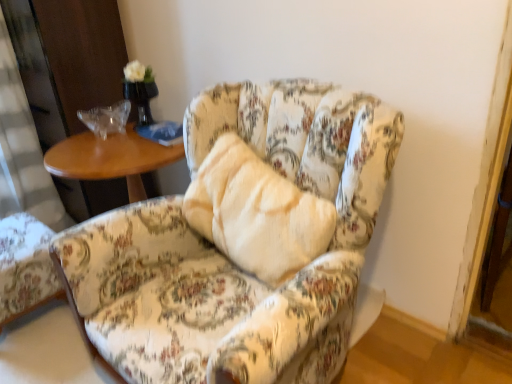
Question: In terms of height, does floral fabric chair at center, marked as the 2th chair in a left-to-right arrangement, look taller or shorter compared to floral fabric armchair at lower left, the 2th chair in the right-to-left sequence?

Choices:
 (A) short
 (B) tall

Answer: (B)

Question: Considering the positions of point (176, 379) and point (13, 220), is point (176, 379) closer or farther from the camera than point (13, 220)?

Choices:
 (A) farther
 (B) closer

Answer: (B)

Question: In terms of size, does floral fabric chair at center, marked as the 2th chair in a left-to-right arrangement, appear bigger or smaller than floral fabric armchair at lower left, which ranks as the 1th chair in left-to-right order?

Choices:
 (A) big
 (B) small

Answer: (A)

Question: Do you think floral fabric armchair at lower left, the 2th chair in the right-to-left sequence, is within floral fabric chair at center, marked as the 2th chair in a left-to-right arrangement, or outside of it?

Choices:
 (A) inside
 (B) outside

Answer: (B)

Question: From the image's perspective, is floral fabric armchair at lower left, the 2th chair in the right-to-left sequence, located above or below floral fabric chair at center, placed as the first chair when sorted from right to left?

Choices:
 (A) below
 (B) above

Answer: (A)

Question: Considering the positions of floral fabric armchair at lower left, which ranks as the 1th chair in left-to-right order, and floral fabric chair at center, placed as the first chair when sorted from right to left, in the image, is floral fabric armchair at lower left, which ranks as the 1th chair in left-to-right order, wider or thinner than floral fabric chair at center, placed as the first chair when sorted from right to left,?

Choices:
 (A) thin
 (B) wide

Answer: (A)

Question: Is floral fabric armchair at lower left, the 2th chair in the right-to-left sequence, in front of or behind floral fabric chair at center, placed as the first chair when sorted from right to left, in the image?

Choices:
 (A) behind
 (B) front

Answer: (A)